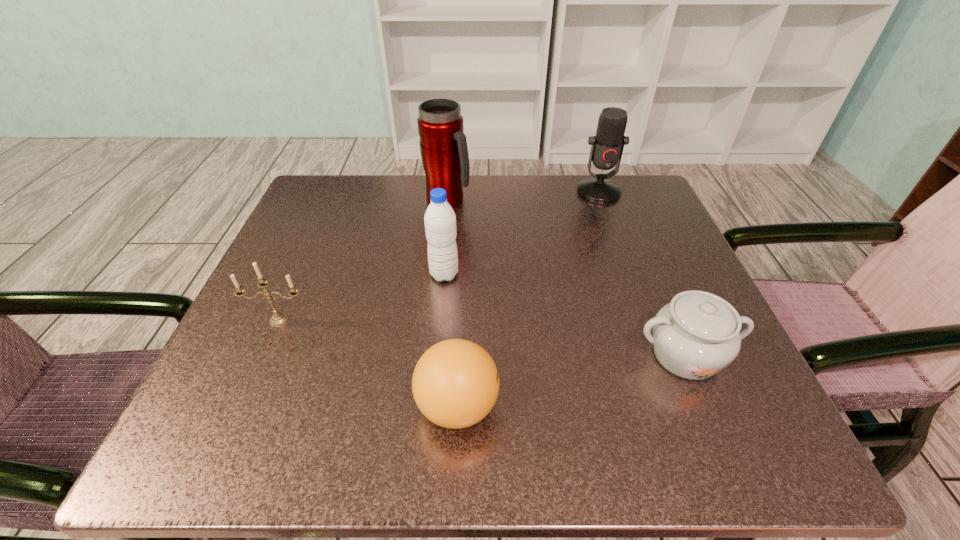
Locate an element on the screen. free space located on the side with brand of the ping-pong ball is located at coordinates (643, 406).

Image resolution: width=960 pixels, height=540 pixels. In order to click on vacant space located 0.210m on the left of the chinaware in this screenshot , I will do `click(503, 355)`.

Locate an element on the screen. thermos bottle positioned at the far edge is located at coordinates coord(443,145).

The width and height of the screenshot is (960, 540). I want to click on microphone present at the far edge, so 607,146.

Where is `object that is at the near edge`? object that is at the near edge is located at coordinates (455, 384).

Find the location of a particular element. The height and width of the screenshot is (540, 960). object that is at the left edge is located at coordinates (278, 318).

Where is `microphone that is at the right edge`? This screenshot has height=540, width=960. microphone that is at the right edge is located at coordinates (607, 146).

The height and width of the screenshot is (540, 960). Find the location of `chinaware situated at the right edge`. chinaware situated at the right edge is located at coordinates (695, 336).

Find the location of a particular element. object that is at the far right corner is located at coordinates (607, 146).

In order to click on vacant space at the far edge in this screenshot , I will do `click(387, 228)`.